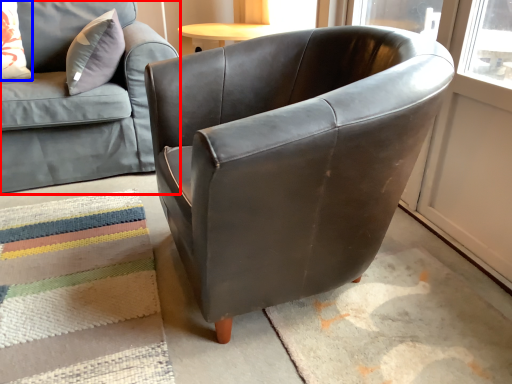
Question: Which object appears farthest to the camera in this image, studio couch (highlighted by a red box) or pillow (highlighted by a blue box)?

Choices:
 (A) studio couch
 (B) pillow

Answer: (B)